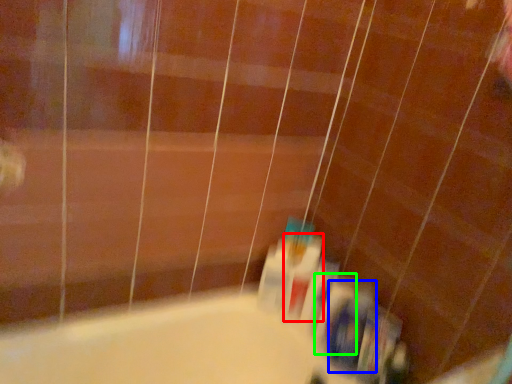
Question: Based on their relative distances, which object is farther from mouthwash (highlighted by a red box)? Choose from toiletry (highlighted by a blue box) and toiletry (highlighted by a green box).

Choices:
 (A) toiletry
 (B) toiletry

Answer: (A)